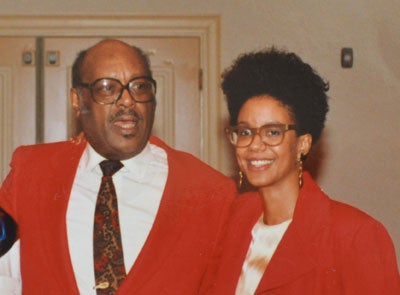
Find the location of a particular element. The image size is (400, 295). doors is located at coordinates (15, 88), (53, 101).